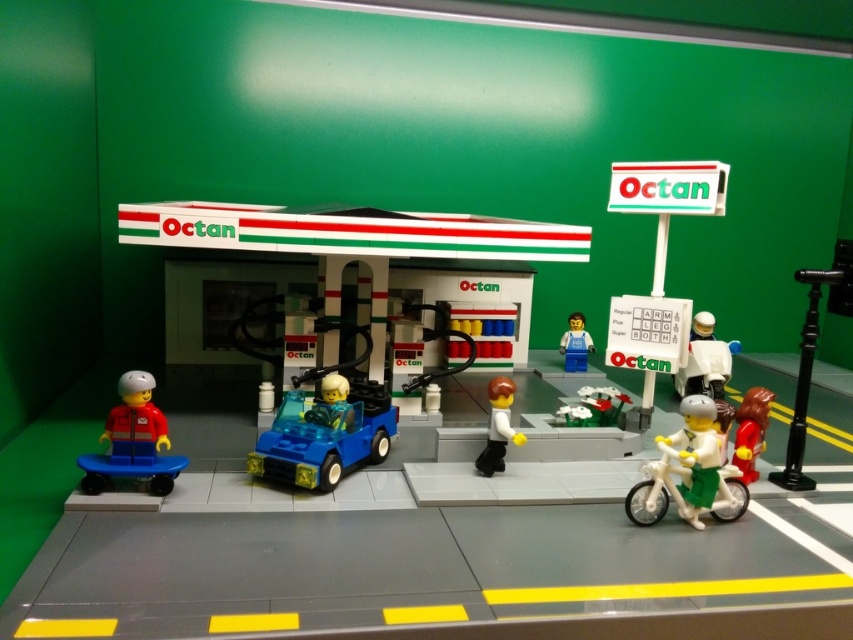
Question: Does white matte scooter at right appear on the left side of white matte figure at center?

Choices:
 (A) yes
 (B) no

Answer: (B)

Question: Does green plastic motorcycle at center-right appear under white matte figure at center?

Choices:
 (A) yes
 (B) no

Answer: (A)

Question: Which point is closer to the camera?

Choices:
 (A) (753, 476)
 (B) (602, 390)
 (C) (703, 468)

Answer: (C)

Question: Which of the following is the farthest from the observer?

Choices:
 (A) (173, 461)
 (B) (619, 394)
 (C) (756, 404)

Answer: (B)

Question: Can you confirm if white matte scooter at right is positioned above green matte flower bed at center?

Choices:
 (A) yes
 (B) no

Answer: (A)

Question: Which point is closer to the camera?

Choices:
 (A) white matte scooter at right
 (B) smooth red bicycle at lower right
 (C) green plastic motorcycle at center-right

Answer: (C)